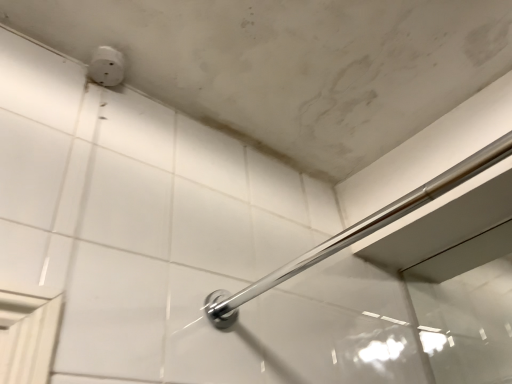
Question: Can you confirm if polished chrome bar at upper center is smaller than white plastic outlet at upper left?

Choices:
 (A) no
 (B) yes

Answer: (A)

Question: From a real-world perspective, is polished chrome bar at upper center positioned under white plastic outlet at upper left based on gravity?

Choices:
 (A) no
 (B) yes

Answer: (B)

Question: Is polished chrome bar at upper center behind white plastic outlet at upper left?

Choices:
 (A) no
 (B) yes

Answer: (A)

Question: Is polished chrome bar at upper center looking in the opposite direction of white plastic outlet at upper left?

Choices:
 (A) no
 (B) yes

Answer: (A)

Question: Is polished chrome bar at upper center far from white plastic outlet at upper left?

Choices:
 (A) yes
 (B) no

Answer: (B)

Question: Is polished chrome bar at upper center aimed at white plastic outlet at upper left?

Choices:
 (A) no
 (B) yes

Answer: (A)

Question: Could you tell me if white plastic outlet at upper left is facing polished chrome bar at upper center?

Choices:
 (A) no
 (B) yes

Answer: (A)

Question: Is white plastic outlet at upper left further to the viewer compared to polished chrome bar at upper center?

Choices:
 (A) no
 (B) yes

Answer: (B)

Question: Is white plastic outlet at upper left located outside polished chrome bar at upper center?

Choices:
 (A) yes
 (B) no

Answer: (A)

Question: Considering the relative sizes of white plastic outlet at upper left and polished chrome bar at upper center in the image provided, is white plastic outlet at upper left wider than polished chrome bar at upper center?

Choices:
 (A) no
 (B) yes

Answer: (A)

Question: From a real-world perspective, is white plastic outlet at upper left on polished chrome bar at upper center?

Choices:
 (A) no
 (B) yes

Answer: (B)

Question: Is white plastic outlet at upper left directly adjacent to polished chrome bar at upper center?

Choices:
 (A) yes
 (B) no

Answer: (B)

Question: In the image, is polished chrome bar at upper center positioned in front of or behind white plastic outlet at upper left?

Choices:
 (A) behind
 (B) front

Answer: (B)